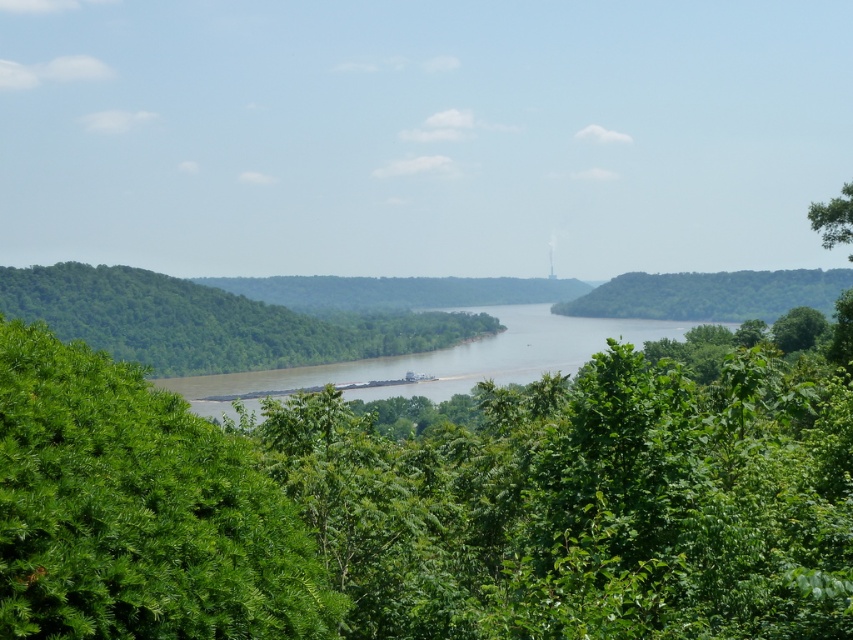
Question: Which object is closer to the camera taking this photo?

Choices:
 (A) green leafy tree at left
 (B) green leafy tree at right
 (C) green leafy tree at center
 (D) brown/muddy water at center

Answer: (C)

Question: Which is nearer to the brown/muddy water at center?

Choices:
 (A) green leafy tree at right
 (B) green leafy tree at center
 (C) green leafy tree at left

Answer: (C)

Question: Is green leafy tree at center bigger than brown/muddy water at center?

Choices:
 (A) no
 (B) yes

Answer: (A)

Question: Does green leafy tree at center lie in front of green leafy tree at right?

Choices:
 (A) yes
 (B) no

Answer: (A)

Question: Estimate the real-world distances between objects in this image. Which object is closer to the green leafy tree at right?

Choices:
 (A) green leafy tree at center
 (B) green leafy tree at left
 (C) brown/muddy water at center

Answer: (C)

Question: Is green leafy tree at center bigger than green leafy tree at left?

Choices:
 (A) yes
 (B) no

Answer: (B)